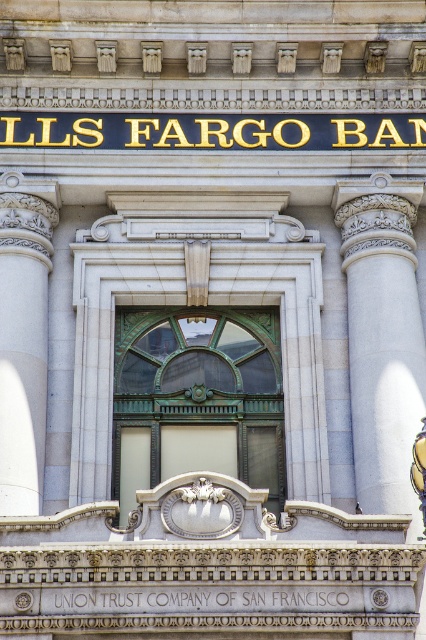
Can you confirm if white marble column at right is positioned to the left of gold metallic sign at upper center?

No, white marble column at right is not to the left of gold metallic sign at upper center.

Is point (385, 310) positioned behind point (313, 120)?

No, (385, 310) is in front of (313, 120).

This screenshot has height=640, width=426. I want to click on white marble column at right, so click(x=382, y=337).

Measure the distance from green glass door at center to gold metallic sign at upper center.

10.17 meters

Is green glass door at center shorter than gold metallic sign at upper center?

Incorrect, green glass door at center's height does not fall short of gold metallic sign at upper center's.

The image size is (426, 640). I want to click on green glass door at center, so click(x=198, y=397).

Is point (43, 234) positioned before point (54, 598)?

No, it is behind (54, 598).

Is white marble column at left smaller than black stone text at center?

No, white marble column at left is not smaller than black stone text at center.

This screenshot has width=426, height=640. Find the location of `white marble column at left`. white marble column at left is located at coordinates (23, 340).